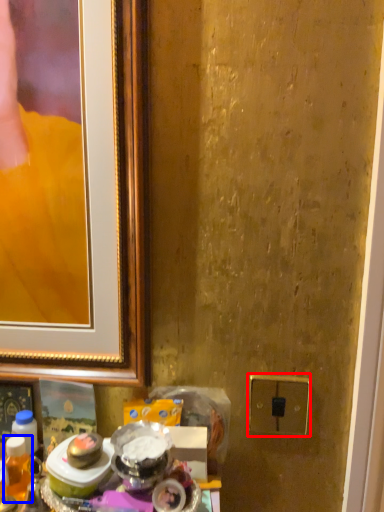
Question: Among these objects, which one is farthest to the camera, electric outlet (highlighted by a red box) or beverage (highlighted by a blue box)?

Choices:
 (A) electric outlet
 (B) beverage

Answer: (A)